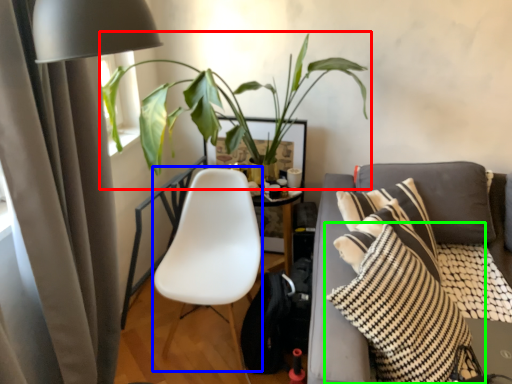
Question: Based on their relative distances, which object is farther from houseplant (highlighted by a red box)? Choose from rocking chair (highlighted by a blue box) and pillow (highlighted by a green box).

Choices:
 (A) rocking chair
 (B) pillow

Answer: (B)